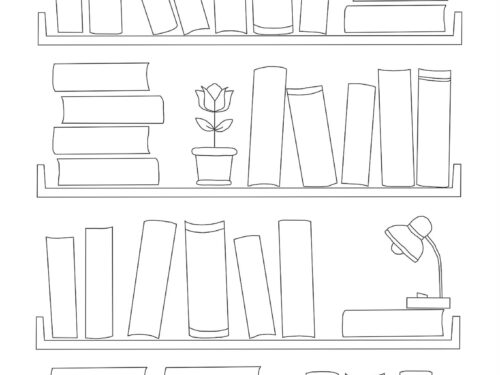
Where is `horizontal books`? The height and width of the screenshot is (375, 500). horizontal books is located at coordinates [x=405, y=22], [x=124, y=73], [x=122, y=104], [x=110, y=137], [x=112, y=170], [x=391, y=321], [x=205, y=370], [x=117, y=370].